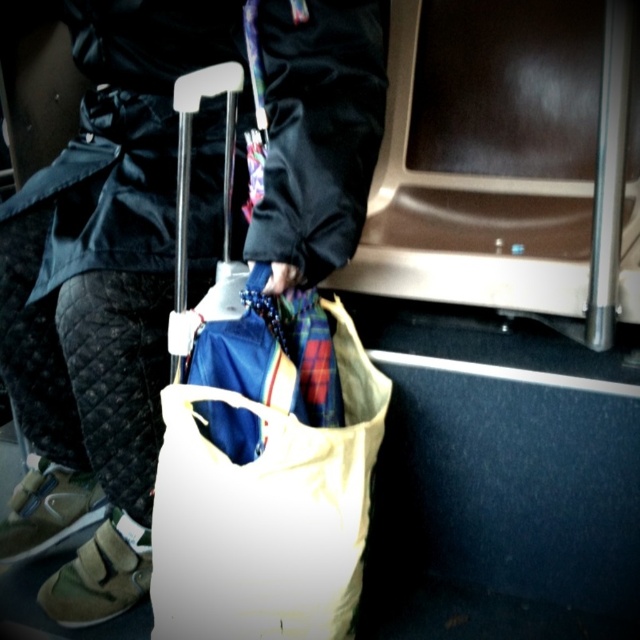
Question: Does matte black jacket at center have a larger size compared to white canvas bag at center?

Choices:
 (A) no
 (B) yes

Answer: (B)

Question: Is the position of matte black jacket at center less distant than that of white canvas bag at center?

Choices:
 (A) yes
 (B) no

Answer: (B)

Question: Which point is farther to the camera?

Choices:
 (A) (93, 602)
 (B) (298, 634)

Answer: (A)

Question: Observing the image, what is the correct spatial positioning of matte black jacket at center in reference to white canvas bag at center?

Choices:
 (A) left
 (B) right

Answer: (A)

Question: Among these points, which one is farthest from the camera?

Choices:
 (A) (202, 525)
 (B) (132, 179)

Answer: (B)